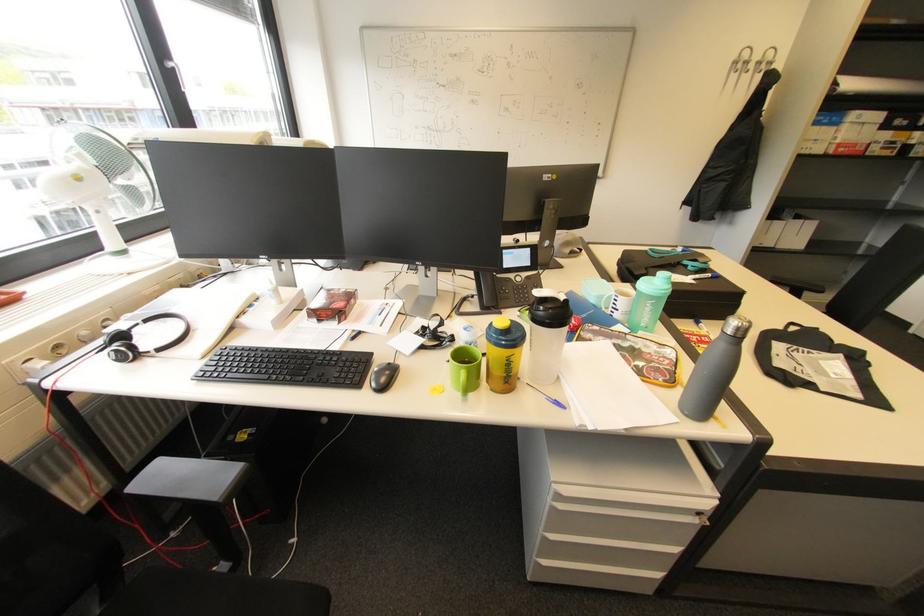
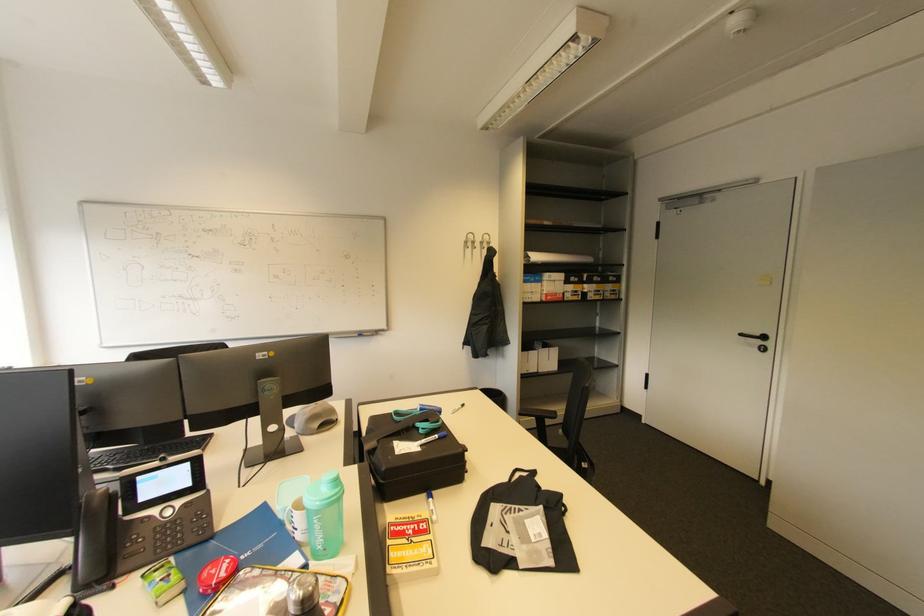
Find the pixel in the second image that matches the point at 696,322 in the first image.

(429, 496)